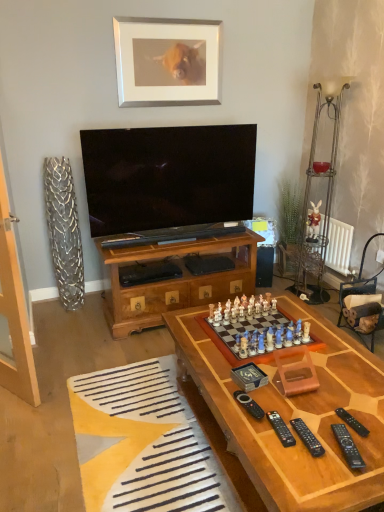
Locate an element on the screen. The height and width of the screenshot is (512, 384). vacant space that is in between black plastic remote at lower right, which appears as the 5th remote when viewed from the left, and black plastic remote at center, which ranks as the 5th remote in right-to-left order is located at coordinates (294, 413).